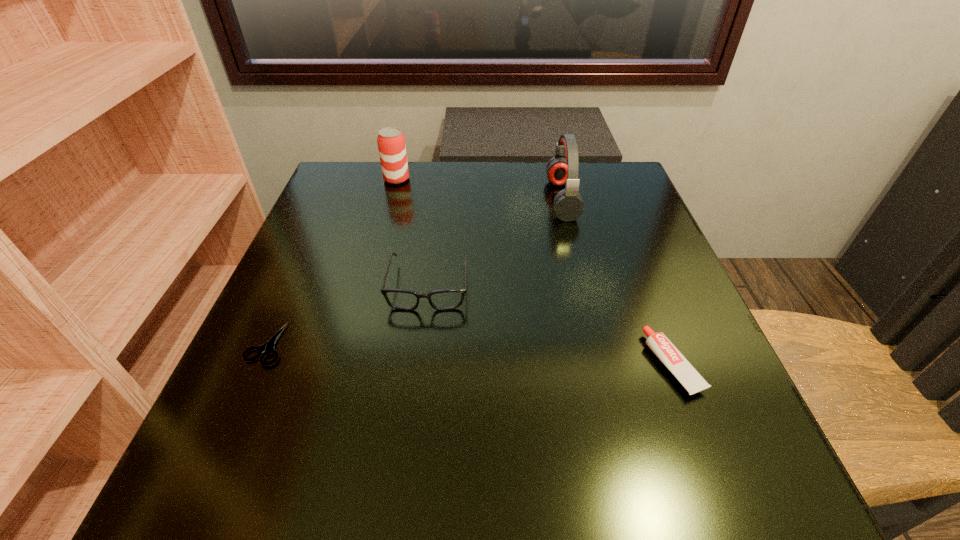
Where is `earphone`? earphone is located at coordinates (562, 169).

This screenshot has width=960, height=540. Find the location of `the tallest object`. the tallest object is located at coordinates (562, 169).

Where is `the second tallest object`? the second tallest object is located at coordinates (391, 141).

Locate an element on the screen. The width and height of the screenshot is (960, 540). the second object from left to right is located at coordinates (391, 141).

The image size is (960, 540). What are the coordinates of `the third nearest object` in the screenshot? It's located at (x=445, y=299).

I want to click on the third object from left to right, so click(445, 299).

Find the location of a particular element. the rightmost object is located at coordinates pyautogui.click(x=669, y=355).

The height and width of the screenshot is (540, 960). Find the location of `toothpaste`. toothpaste is located at coordinates (669, 355).

Find the location of a particular element. the leftmost object is located at coordinates (268, 348).

Find the location of a particular element. The width and height of the screenshot is (960, 540). the shortest object is located at coordinates (268, 348).